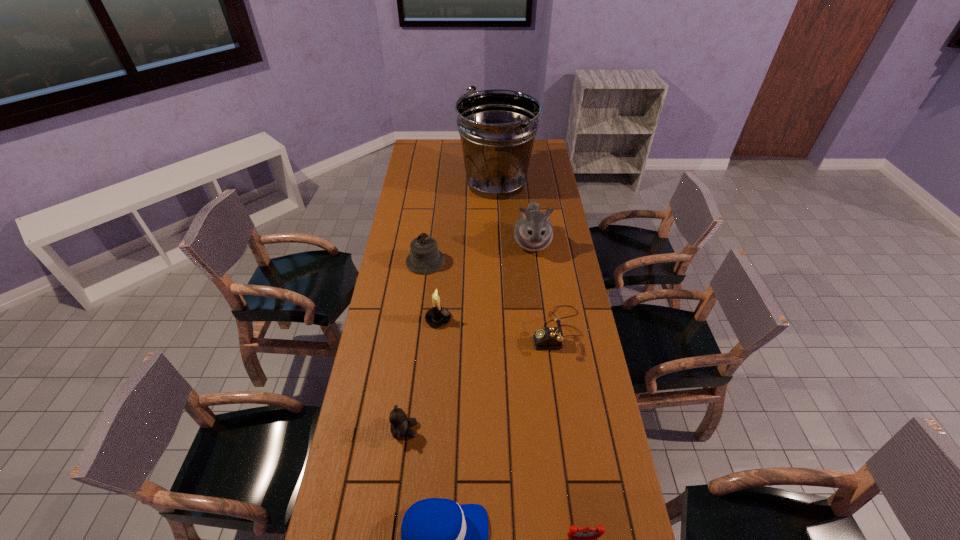
Point out which object is positioned as the second nearest to the candle holder. Please provide its 2D coordinates. Your answer should be formatted as a tuple, i.e. [(x, y)], where the tuple contains the x and y coordinates of a point satisfying the conditions above.

[(551, 337)]